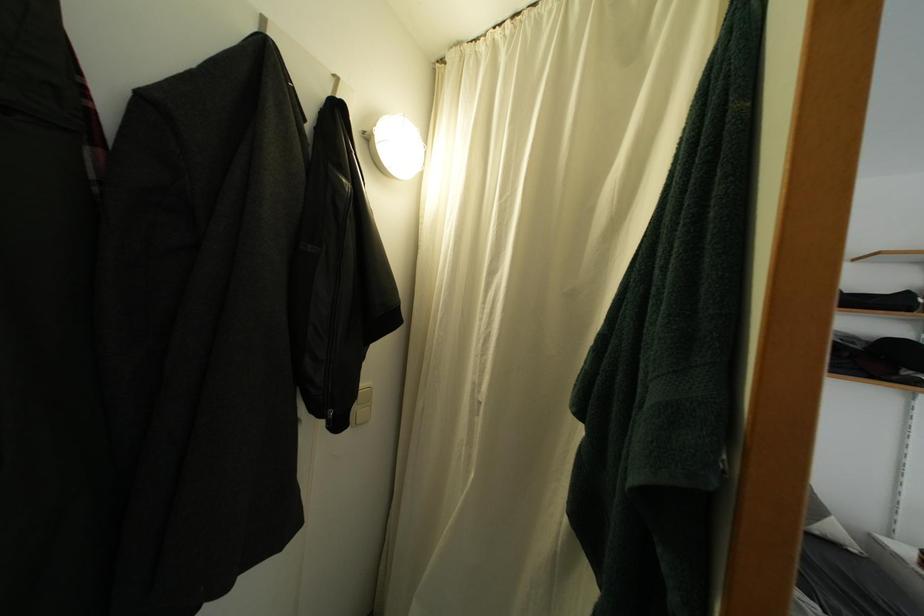
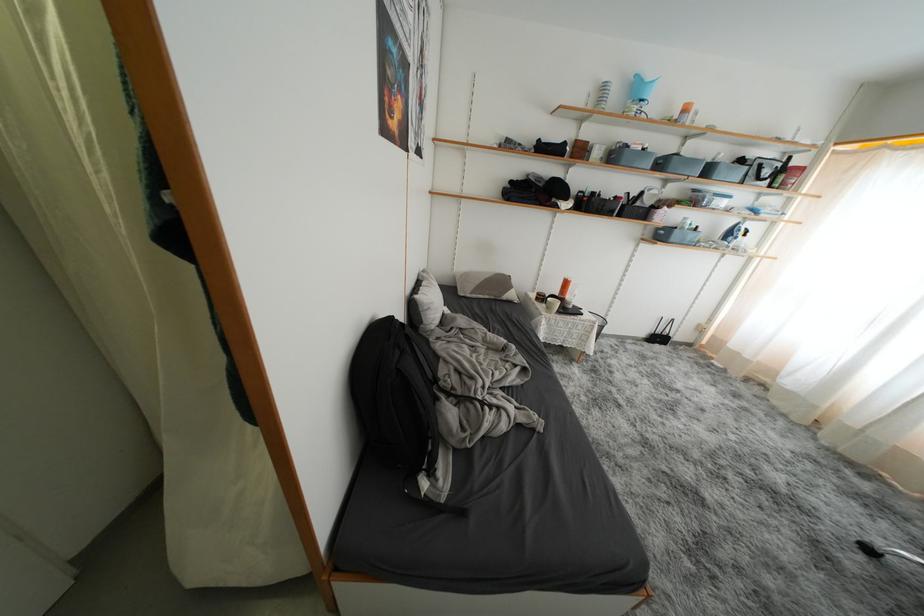
The images are taken continuously from a first-person perspective. In which direction is your viewpoint rotating?

The rotation direction of the camera is right-down.